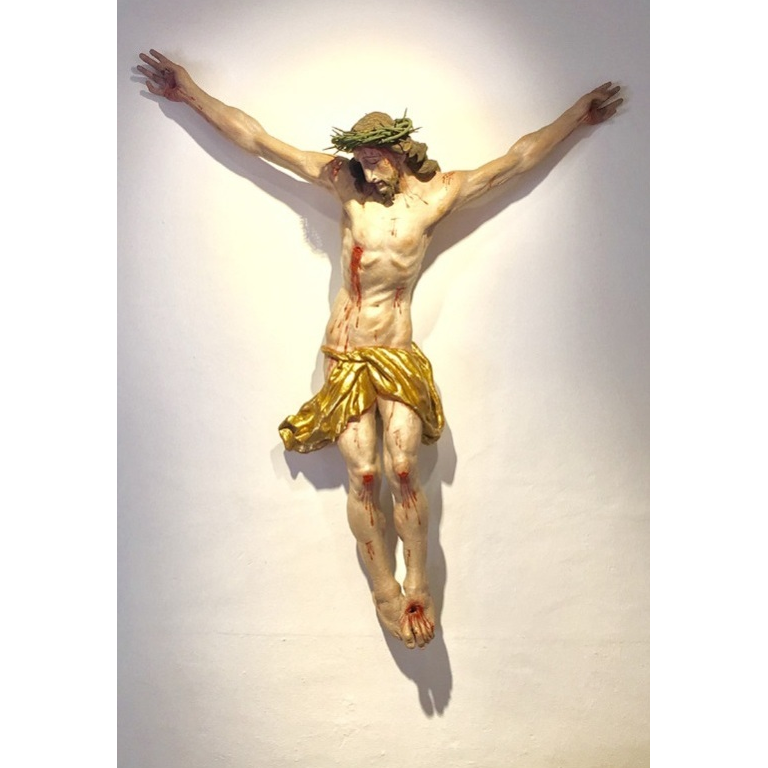
In order to click on shadow against the wall in this screenshot , I will do `click(429, 468)`, `click(319, 458)`.